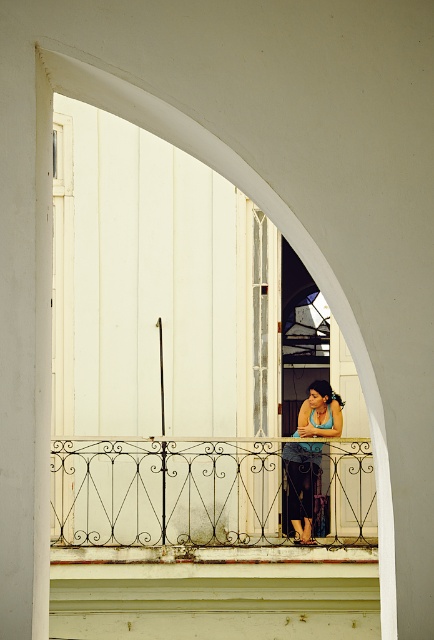
Is white wrought iron balustrade at center shorter than white matte archway at center?

Yes, white wrought iron balustrade at center is shorter than white matte archway at center.

Which of these two, white wrought iron balustrade at center or white matte archway at center, stands shorter?

With less height is white wrought iron balustrade at center.

Between point (131, 515) and point (328, 292), which one is positioned in front?

Point (328, 292)

Image resolution: width=434 pixels, height=640 pixels. I want to click on white wrought iron balustrade at center, so click(x=171, y=492).

Between white matte archway at center and blue fabric tank top at center, which one is positioned higher?

Positioned higher is white matte archway at center.

What do you see at coordinates (256, 202) in the screenshot? The width and height of the screenshot is (434, 640). I see `white matte archway at center` at bounding box center [256, 202].

Who is more distant from viewer, (286,211) or (302,456)?

Point (302,456)

Locate an element on the screen. This screenshot has width=434, height=640. white matte archway at center is located at coordinates (256, 202).

Can you confirm if white wrought iron balustrade at center is positioned to the left of blue fabric tank top at center?

Correct, you'll find white wrought iron balustrade at center to the left of blue fabric tank top at center.

Who is shorter, white wrought iron balustrade at center or blue fabric tank top at center?

white wrought iron balustrade at center is shorter.

Is point (72, 456) farther from viewer compared to point (319, 392)?

No, (72, 456) is closer to viewer.

The height and width of the screenshot is (640, 434). In order to click on white wrought iron balustrade at center in this screenshot , I will do `click(171, 492)`.